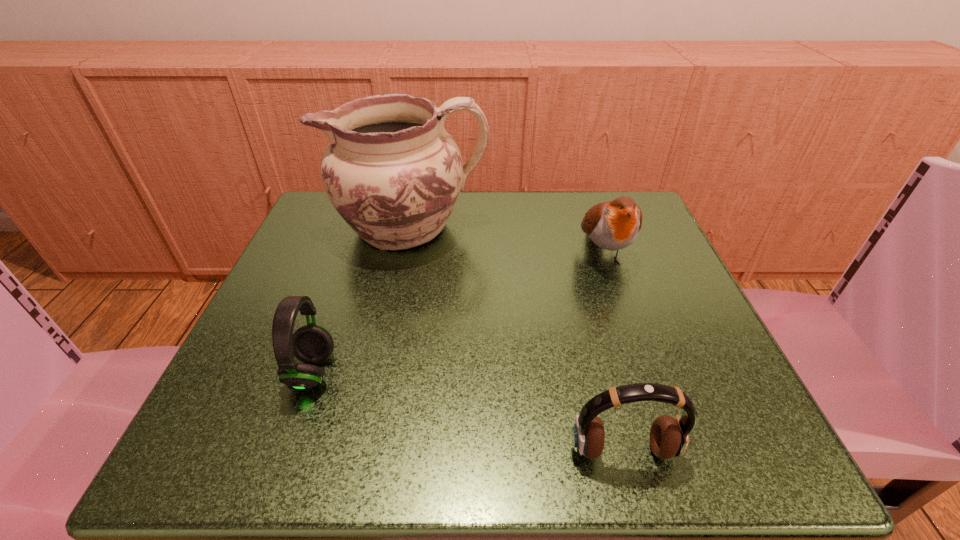
Identify the location of unoccupied position between the nearest object and the second nearest object. (468, 411).

Where is `unoccupied area between the nearest object and the left headset`? The height and width of the screenshot is (540, 960). unoccupied area between the nearest object and the left headset is located at coordinates (468, 411).

Identify the location of free space between the farther headset and the nearer headset. This screenshot has height=540, width=960. (468, 411).

Find the location of a particular element. Image resolution: width=960 pixels, height=540 pixels. blank region between the farther headset and the pitcher is located at coordinates (361, 300).

Identify the location of vacant area that lies between the bird and the nearest object. The width and height of the screenshot is (960, 540). (613, 353).

Identify which object is the third closest to the nearest object. Please provide its 2D coordinates. Your answer should be formatted as a tuple, i.e. [(x, y)], where the tuple contains the x and y coordinates of a point satisfying the conditions above.

[(393, 173)]

Locate which object ranks third in proximity to the tallest object. Please provide its 2D coordinates. Your answer should be formatted as a tuple, i.e. [(x, y)], where the tuple contains the x and y coordinates of a point satisfying the conditions above.

[(669, 437)]

What are the coordinates of `vacant space that satisfies the following two spatial constraints: 1. at the face of the bird; 2. on the ear cups of the third farthest object` in the screenshot? It's located at pos(643,372).